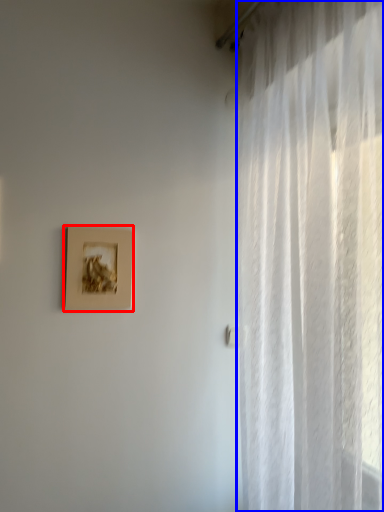
Question: Which point is further to the camera, picture frame (highlighted by a red box) or curtain (highlighted by a blue box)?

Choices:
 (A) picture frame
 (B) curtain

Answer: (A)